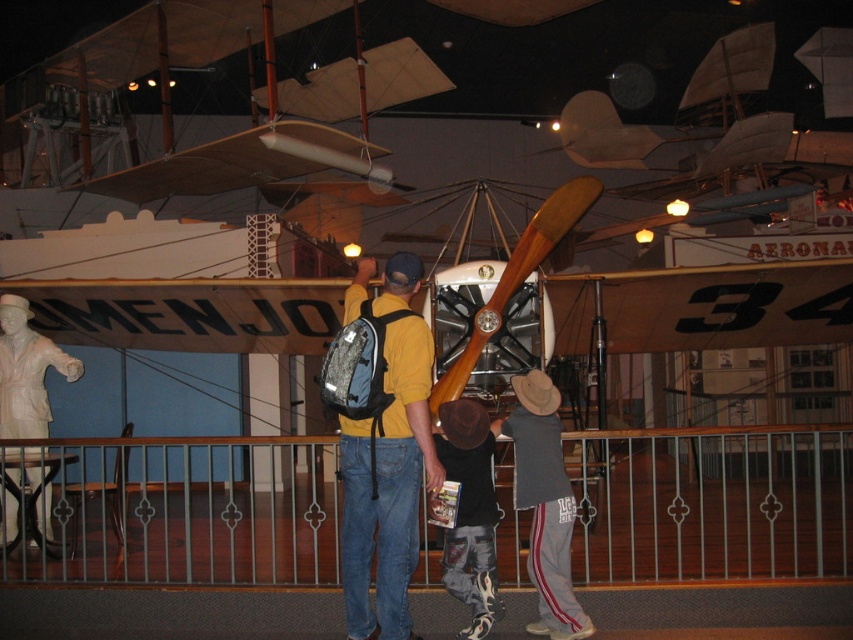
You are standing at the center of the aviation museum and see the point marked at coordinates (x=544, y=502). What object is located at that specific coordinate?

The gray cotton shirt at lower center is located at the point marked at coordinates (x=544, y=502).